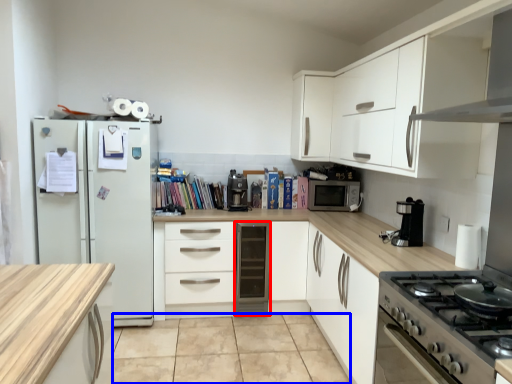
Question: Which of the following is the closest to the observer, file cabinet (highlighted by a red box) or tile (highlighted by a blue box)?

Choices:
 (A) file cabinet
 (B) tile

Answer: (B)